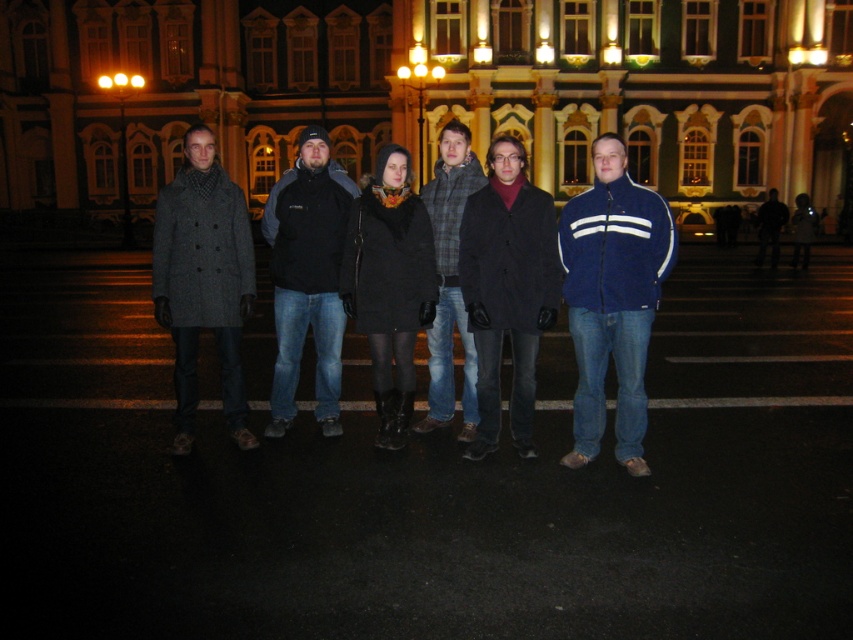
You are standing in front of the illuminated building and want to take a photo of the group. The camera you are using has a zoom lens that can focus on objects within a 0.3 to 0.7 coordinate range on the horizontal axis. Is the dark gray wool coat at center within this focus range?

The dark gray wool coat at center is located at point 0.439 on the horizontal axis, which falls within the 0.3 to 0.7 coordinate range. Therefore, the coat is within the focus range and can be captured clearly in the photo.

You are standing in front of the illuminated building and want to take a photo of the group. The matte black coat at center and the dark gray fleece jacket at center are both in your view. Which one would appear larger in the photo?

The matte black coat at center would appear larger in the photo because it is closer to the viewer than the dark gray fleece jacket at center.

You are a photographer trying to capture a group photo of the matte black coat at center and the dark gray fleece jacket at center. Since you want to focus on the details of both coats, which one should you zoom in on more to ensure it doesn t look too small in the photo?

The matte black coat at center has a lesser width compared to dark gray fleece jacket at center, so you should zoom in more on the matte black coat at center to ensure it doesn t appear too small compared to the larger jacket.